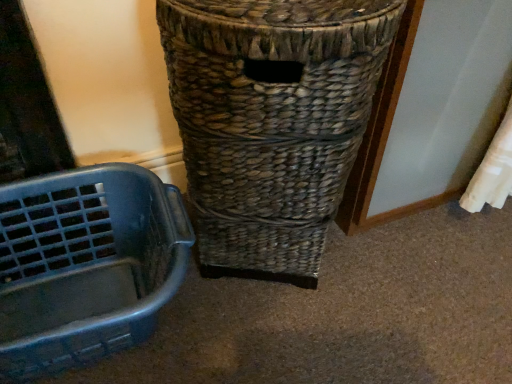
Where is `empty space that is to the right of woven brown basket at center`? Image resolution: width=512 pixels, height=384 pixels. empty space that is to the right of woven brown basket at center is located at coordinates (425, 274).